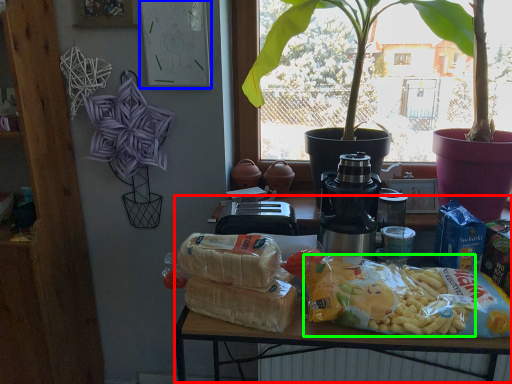
Question: Considering the real-world distances, which object is closest to table (highlighted by a red box)? bulletin board (highlighted by a blue box) or food (highlighted by a green box).

Choices:
 (A) bulletin board
 (B) food

Answer: (B)